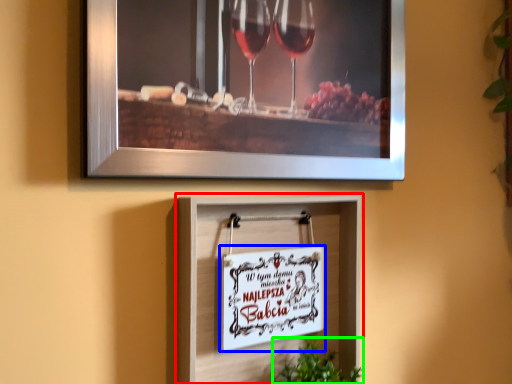
Question: Based on their relative distances, which object is farther from picture frame (highlighted by a red box)? Choose from picture frame (highlighted by a blue box) and plant (highlighted by a green box).

Choices:
 (A) picture frame
 (B) plant

Answer: (B)